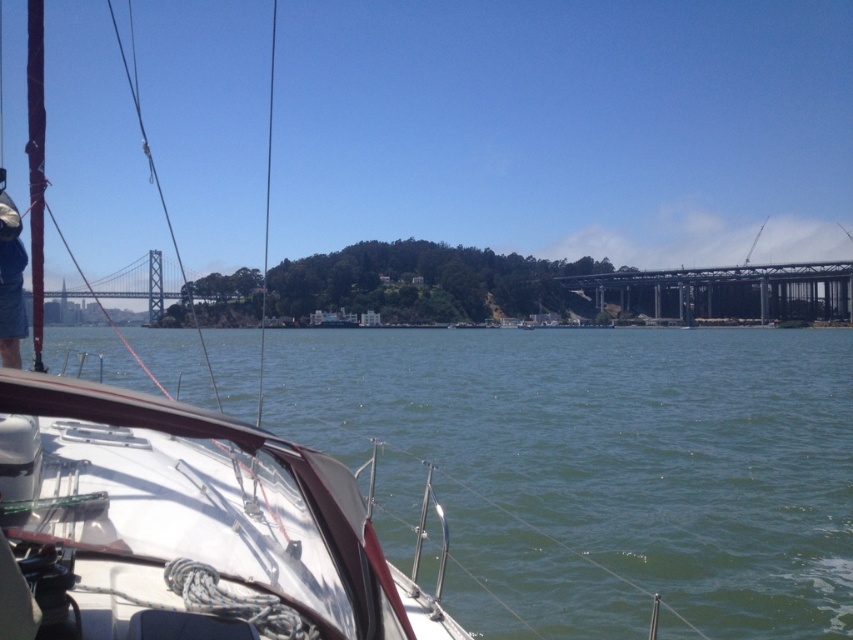
Question: Which of the following is the farthest from the observer?

Choices:
 (A) (3, 268)
 (B) (39, 108)

Answer: (B)

Question: Can you confirm if white matte boat at lower left is thinner than blue denim pants at left?

Choices:
 (A) yes
 (B) no

Answer: (B)

Question: Considering the real-world distances, which object is closest to the white matte boat at lower left?

Choices:
 (A) metallic steel bridge at center
 (B) blue denim pants at left
 (C) green water at lower left

Answer: (B)

Question: Does green water at lower left come in front of blue denim pants at left?

Choices:
 (A) no
 (B) yes

Answer: (A)

Question: Does metallic steel bridge at center have a lesser width compared to smooth dark brown mast at left?

Choices:
 (A) yes
 (B) no

Answer: (B)

Question: Which of the following is the closest to the observer?

Choices:
 (A) (132, 577)
 (B) (735, 269)
 (C) (32, 99)

Answer: (A)